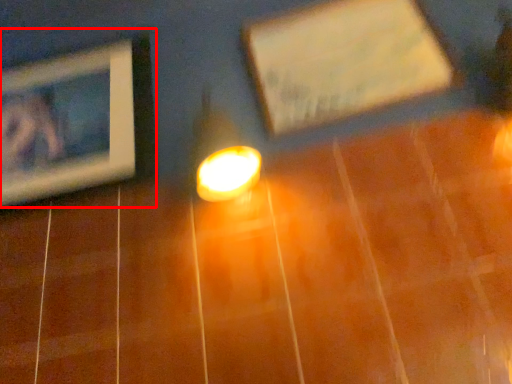
Question: From the image's perspective, where is picture frame (annotated by the red box) located in relation to picture frame in the image?

Choices:
 (A) above
 (B) below

Answer: (B)